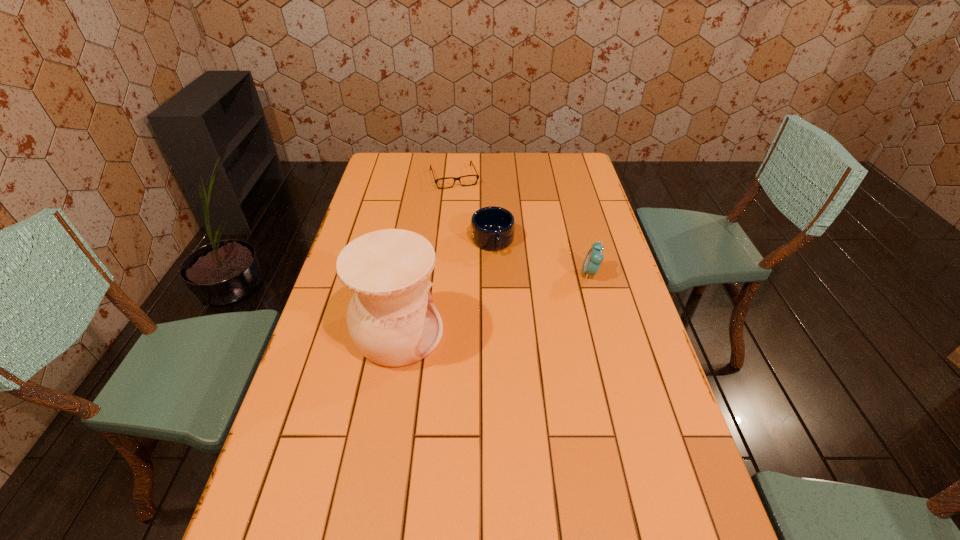
Where is `vacant space positioned 0.180m on the face of the alarm clock`? The image size is (960, 540). vacant space positioned 0.180m on the face of the alarm clock is located at coordinates (525, 273).

Where is `vacant space located on the face of the alarm clock`? The width and height of the screenshot is (960, 540). vacant space located on the face of the alarm clock is located at coordinates (516, 273).

The image size is (960, 540). What are the coordinates of `vacant space positioned with the handle on the side of the mug` in the screenshot? It's located at (506, 287).

Find the location of a particular element. The image size is (960, 540). vacant space located 0.160m with the handle on the side of the mug is located at coordinates (507, 291).

This screenshot has height=540, width=960. Find the location of `free location located with the handle on the side of the mug`. free location located with the handle on the side of the mug is located at coordinates (521, 336).

I want to click on vacant space situated 0.130m on the front-facing side of the shortest object, so click(465, 207).

Identify the location of free space located 0.050m on the front-facing side of the shortest object. This screenshot has height=540, width=960. (461, 196).

Identify the location of free spot located on the front-facing side of the shortest object. This screenshot has height=540, width=960. (462, 199).

Image resolution: width=960 pixels, height=540 pixels. I want to click on object that is at the far edge, so click(477, 176).

Locate an element on the screen. object that is at the left edge is located at coordinates (392, 319).